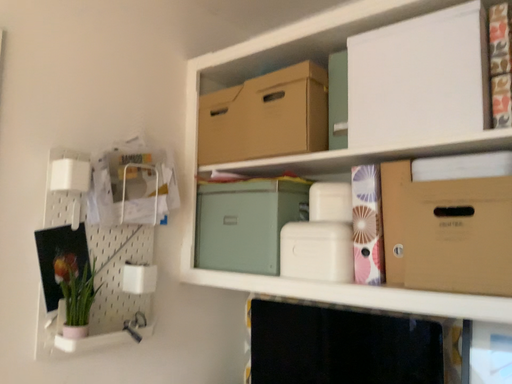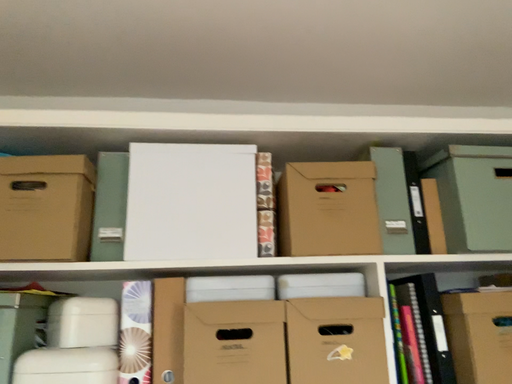
Question: Which way did the camera rotate in the video?

Choices:
 (A) rotated right
 (B) rotated left

Answer: (A)